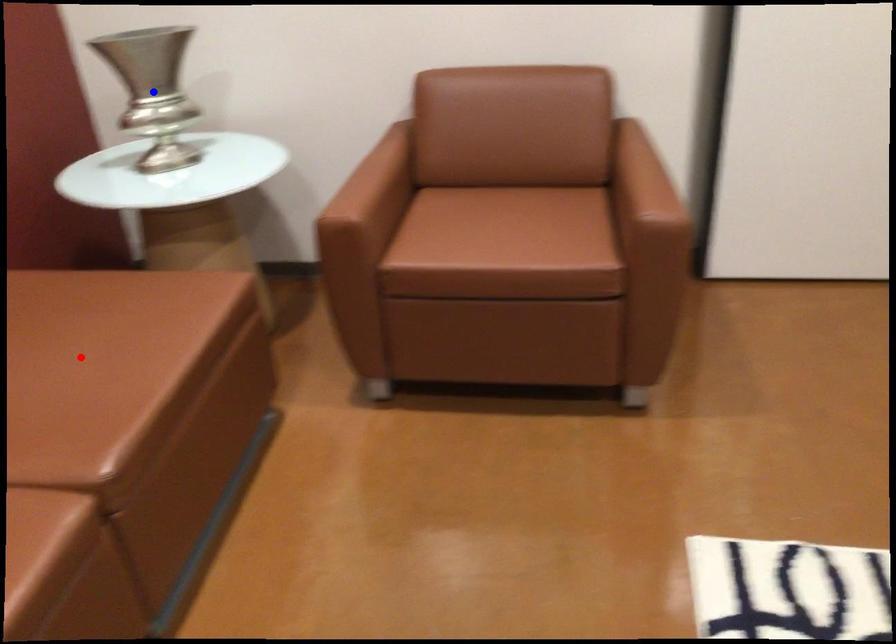
Question: Which of the two points in the image is closer to the camera?

Choices:
 (A) Blue point is closer.
 (B) Red point is closer.

Answer: (B)